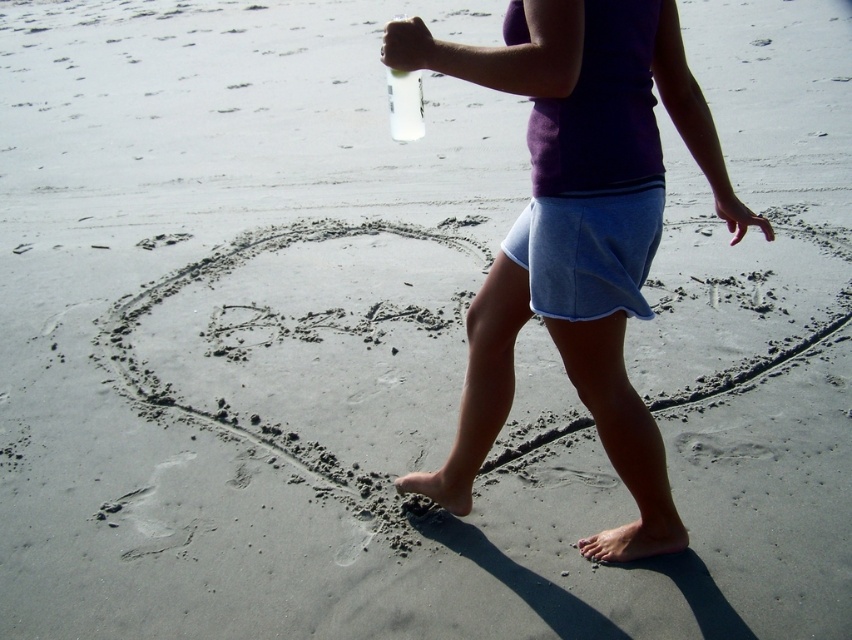
Between purple fabric skirt at center and clear plastic bottle at upper center, which one has less height?

With less height is clear plastic bottle at upper center.

In the scene shown: Is purple fabric skirt at center wider than clear plastic bottle at upper center?

Indeed, purple fabric skirt at center has a greater width compared to clear plastic bottle at upper center.

Identify the location of purple fabric skirt at center. (586, 92).